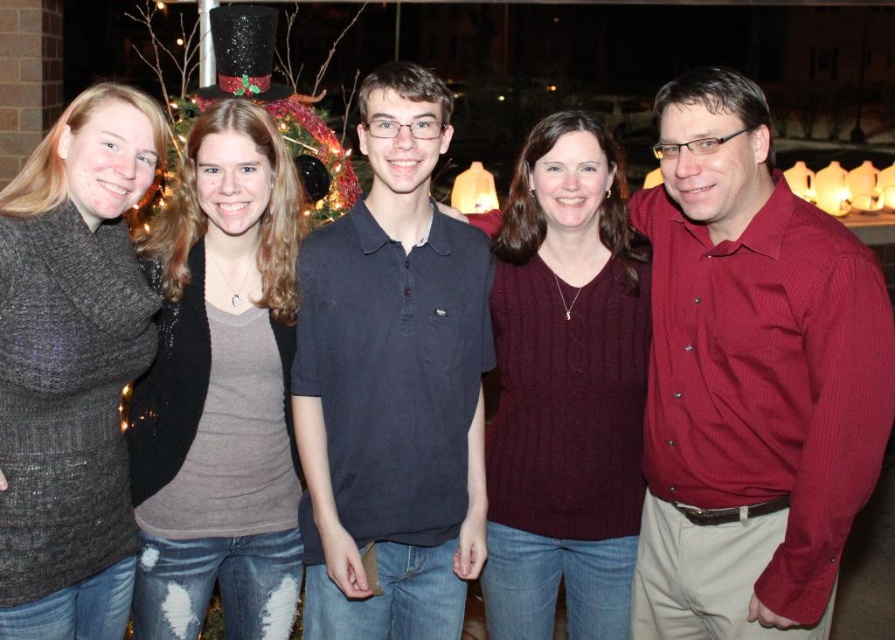
Question: Is cable-knit sweater at center below dark gray knitted sweater at left?

Choices:
 (A) yes
 (B) no

Answer: (A)

Question: Among these points, which one is farthest from the camera?

Choices:
 (A) (7, 600)
 (B) (569, 566)
 (C) (257, 118)
 (D) (313, 220)

Answer: (D)

Question: Among these points, which one is farthest from the camera?

Choices:
 (A) (19, 465)
 (B) (235, 323)
 (C) (604, 294)
 (D) (271, 22)

Answer: (D)

Question: Which object is positioned farthest from the cable-knit sweater at center?

Choices:
 (A) matte gray shirt at center
 (B) dark gray knitted sweater at left

Answer: (B)

Question: Is matte gray shirt at center positioned before dark gray knitted sweater at left?

Choices:
 (A) no
 (B) yes

Answer: (A)

Question: Can you confirm if dark gray knitted sweater at left is smaller than glittering plastic christmas light at upper center?

Choices:
 (A) yes
 (B) no

Answer: (B)